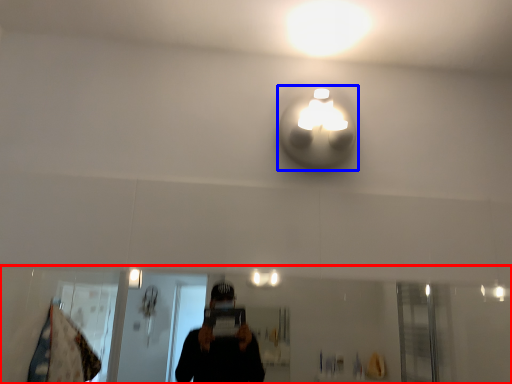
Question: Which point is closer to the camera, mirror (highlighted by a red box) or light (highlighted by a blue box)?

Choices:
 (A) mirror
 (B) light

Answer: (A)